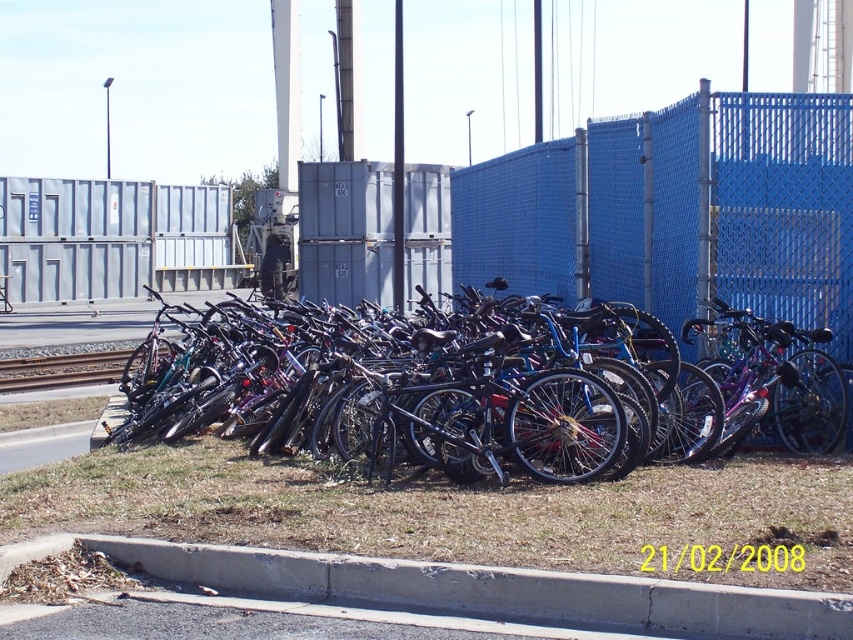
Based on the photo, does shiny metallic bicycles at center have a lesser height compared to brushed metal train track at left?

No.

Consider the image. Between shiny metallic bicycles at center and brushed metal train track at left, which one appears on the right side from the viewer's perspective?

shiny metallic bicycles at center

Where is `shiny metallic bicycles at center`? shiny metallic bicycles at center is located at coordinates (408, 396).

The height and width of the screenshot is (640, 853). Describe the element at coordinates (408, 396) in the screenshot. I see `shiny metallic bicycles at center` at that location.

Does point (759, 339) lie in front of point (247, 586)?

That is False.

Locate an element on the screen. shiny metallic bicycles at center is located at coordinates (408, 396).

Identify the location of blue mesh fence at center. Image resolution: width=853 pixels, height=640 pixels. (782, 208).

In the scene shown: Is blue mesh fence at center positioned at the back of brushed metal train track at left?

No, it is in front of brushed metal train track at left.

Is point (498, 257) positioned before point (6, 378)?

Yes, point (498, 257) is in front of point (6, 378).

Where is `blue mesh fence at center`? The height and width of the screenshot is (640, 853). blue mesh fence at center is located at coordinates (782, 208).